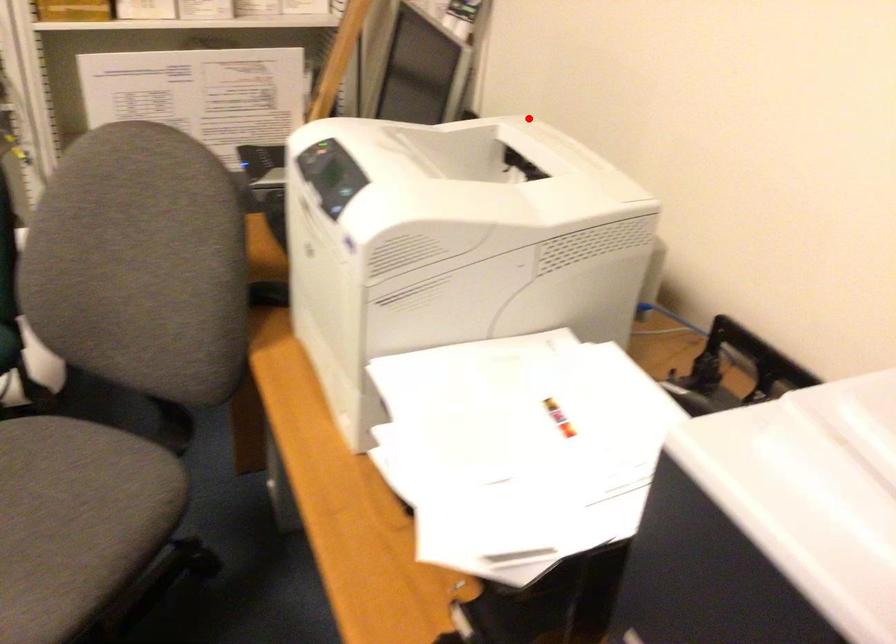
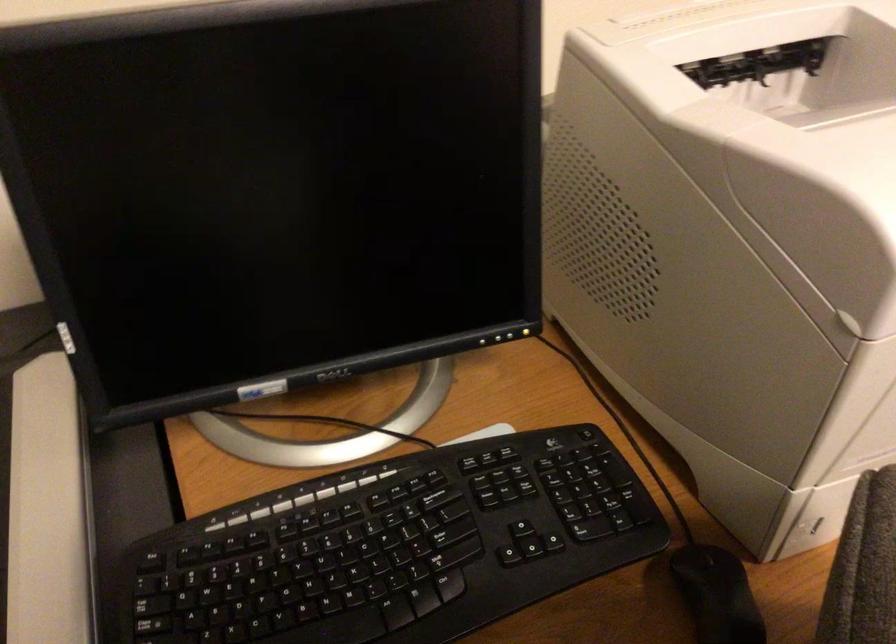
Question: I am providing you with two images of the same scene from different viewpoints. Image1 has a red point marked. In image2, the corresponding 3D location appears at what relative position? Reply with the corresponding letter.

Choices:
 (A) Closer
 (B) Farther

Answer: (A)